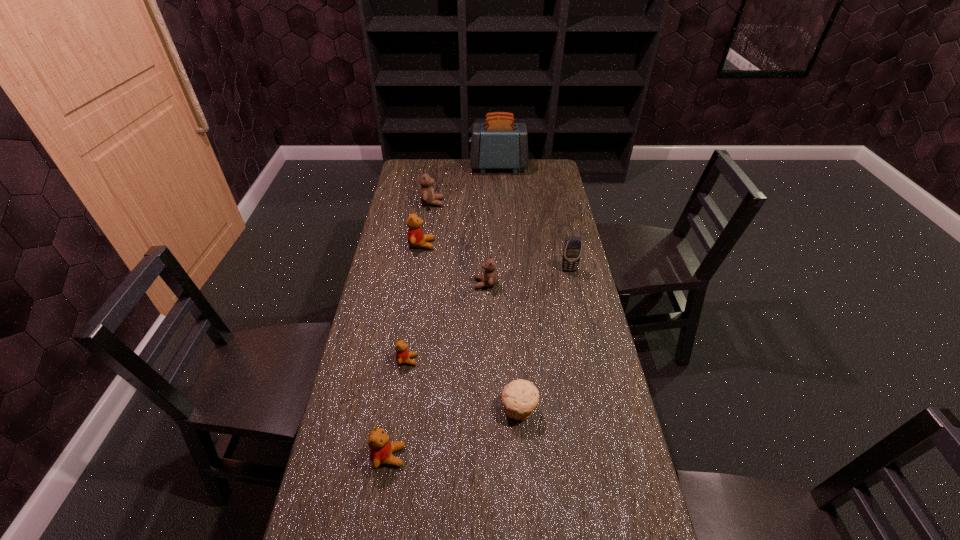
Image resolution: width=960 pixels, height=540 pixels. Find the location of `the farthest object`. the farthest object is located at coordinates (499, 143).

Locate an element on the screen. toaster is located at coordinates (499, 143).

Where is `the bigger brown teddy bear`? The image size is (960, 540). the bigger brown teddy bear is located at coordinates (427, 196).

Identify the location of the farther brown teddy bear. The width and height of the screenshot is (960, 540). (427, 196).

I want to click on the fourth nearest teddy bear, so click(416, 238).

Find the location of a particular element. the biggest red teddy bear is located at coordinates (416, 238).

The width and height of the screenshot is (960, 540). In order to click on the fifth nearest object in this screenshot , I will do `click(572, 250)`.

Identify the location of the rightmost object. 572,250.

In order to click on the nearest object in this screenshot , I will do `click(381, 449)`.

At what (x,y) coordinates should I click in order to perform the action: click on the nearest teddy bear. Please return your answer as a coordinate pair (x, y). This screenshot has width=960, height=540. Looking at the image, I should click on (381, 449).